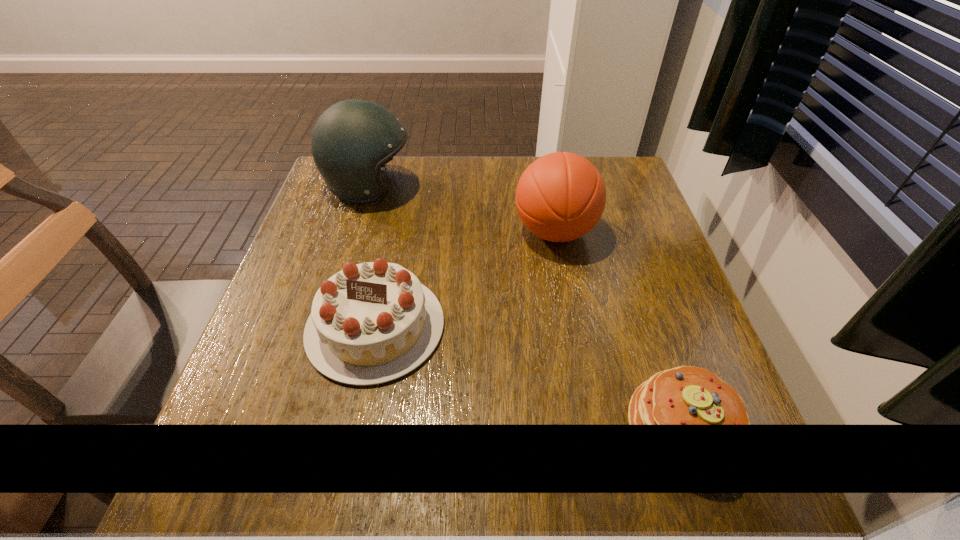
Identify the location of football helmet. Image resolution: width=960 pixels, height=540 pixels. (352, 140).

Identify the location of the second tallest object. This screenshot has height=540, width=960. (561, 196).

Locate an element on the screen. the second shortest object is located at coordinates (370, 323).

Identify the location of the shortest object. Image resolution: width=960 pixels, height=540 pixels. (686, 395).

Identify the location of vacant region located 0.060m at the face opening of the football helmet. (436, 187).

You are a GUI agent. You are given a task and a screenshot of the screen. Output one action in this format:
    pyautogui.click(x=<x>, y=<y>)
    Task: Click on the free region located on the front of the basketball
    
    Given the screenshot: What is the action you would take?
    pyautogui.click(x=582, y=382)

Identify the location of vacant space situated 0.210m on the back of the birthday cake. (398, 217).

You are a GUI agent. You are given a task and a screenshot of the screen. Output one action in this format:
    pyautogui.click(x=<x>, y=<y>)
    Task: Click on the vacant space located 0.170m on the back of the shortest object
    This screenshot has height=540, width=960.
    Given the screenshot: What is the action you would take?
    643,306

You are a GUI agent. You are given a task and a screenshot of the screen. Output one action in this format:
    pyautogui.click(x=<x>, y=<y>)
    Task: Click on the football helmet situated at the far edge
    This screenshot has height=540, width=960.
    Given the screenshot: What is the action you would take?
    pyautogui.click(x=352, y=140)

Find the location of a particular element. Image resolution: width=960 pixels, height=540 pixels. basketball that is at the far edge is located at coordinates (561, 196).